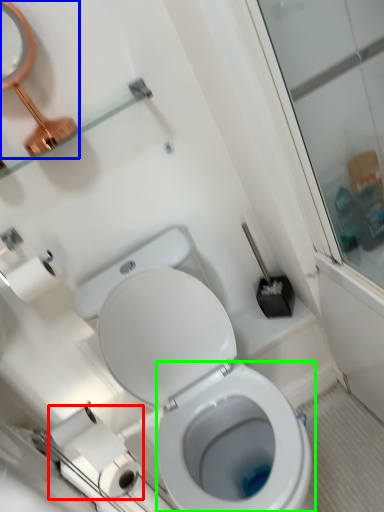
Question: Based on their relative distances, which object is nearer to toilet paper (highlighted by a red box)? Choose from mirror (highlighted by a blue box) and bidet (highlighted by a green box).

Choices:
 (A) mirror
 (B) bidet

Answer: (B)